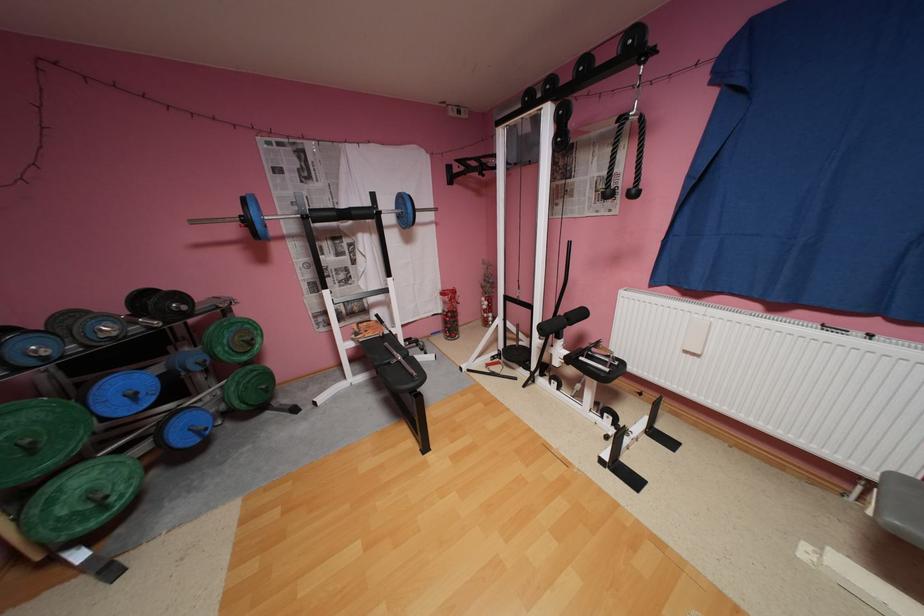
Find where to pull the metal pull bar. Please return your answer as a coordinate pair (x, y).

(286, 216)